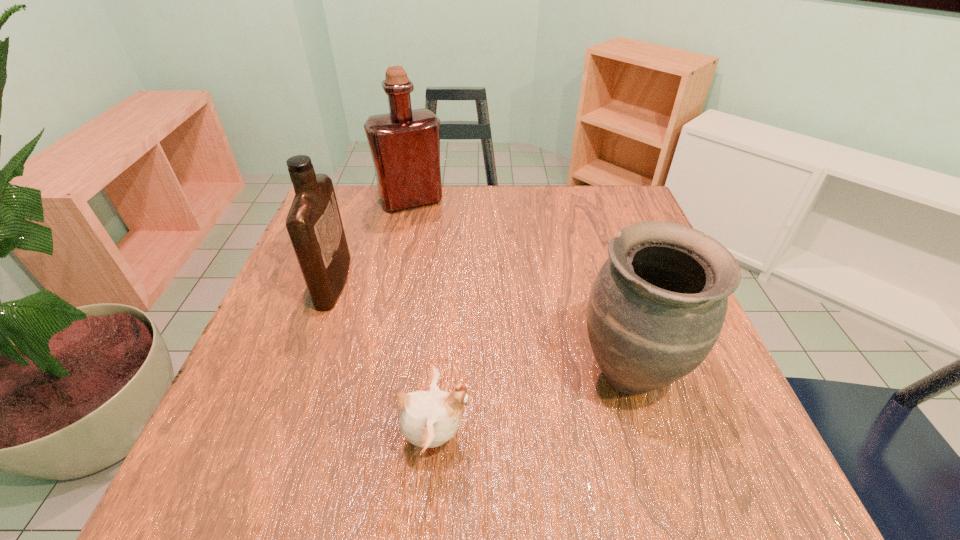
Where is `object that can be found as the closest to the rightmost object`? The height and width of the screenshot is (540, 960). object that can be found as the closest to the rightmost object is located at coordinates (428, 419).

Where is `free space that satisfies the following two spatial constraints: 1. on the back side of the rightmost object; 2. on the label side of the nearer liquor`? Image resolution: width=960 pixels, height=540 pixels. free space that satisfies the following two spatial constraints: 1. on the back side of the rightmost object; 2. on the label side of the nearer liquor is located at coordinates (602, 282).

What are the coordinates of `vacant space that satisfies the following two spatial constraints: 1. on the label side of the rightmost object; 2. on the right side of the second farthest object` in the screenshot? It's located at (300, 374).

Where is `free spot that satisfies the following two spatial constraints: 1. on the label side of the nearer liquor; 2. on the left side of the urn`? This screenshot has height=540, width=960. free spot that satisfies the following two spatial constraints: 1. on the label side of the nearer liquor; 2. on the left side of the urn is located at coordinates (300, 374).